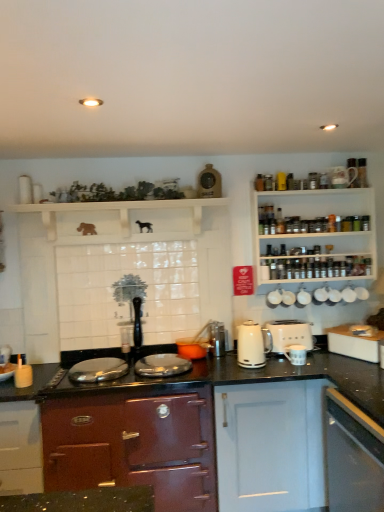
Question: From the image's perspective, is metallic silver kettle at center, the 2th appliance in the left-to-right sequence, over shiny burgundy cabinet at center, the 3th cabinetry from the right?

Choices:
 (A) yes
 (B) no

Answer: (A)

Question: Is metallic silver kettle at center, the second appliance from the bottom, thinner than shiny burgundy cabinet at center, the 3th cabinetry from the right?

Choices:
 (A) yes
 (B) no

Answer: (A)

Question: Would you say metallic silver kettle at center, the second appliance from the bottom, contains shiny burgundy cabinet at center, positioned as the first cabinetry in left-to-right order?

Choices:
 (A) no
 (B) yes

Answer: (A)

Question: Considering the relative sizes of metallic silver kettle at center, the second appliance from the bottom, and shiny burgundy cabinet at center, the 3th cabinetry from the right, in the image provided, is metallic silver kettle at center, the second appliance from the bottom, wider than shiny burgundy cabinet at center, the 3th cabinetry from the right,?

Choices:
 (A) yes
 (B) no

Answer: (B)

Question: Could you tell me if metallic silver kettle at center, the second appliance from the bottom, is facing shiny burgundy cabinet at center, positioned as the first cabinetry in left-to-right order?

Choices:
 (A) yes
 (B) no

Answer: (B)

Question: Is metallic silver kettle at center, acting as the fourth appliance starting from the top, to the left of shiny burgundy cabinet at center, the 3th cabinetry from the right, from the viewer's perspective?

Choices:
 (A) no
 (B) yes

Answer: (A)

Question: Can you confirm if metallic silver kettle at center, which is the 4th appliance in right-to-left order, is positioned to the left of white wooden spice rack at upper right?

Choices:
 (A) no
 (B) yes

Answer: (B)

Question: From a real-world perspective, is metallic silver kettle at center, the 2th appliance in the left-to-right sequence, physically above white wooden spice rack at upper right?

Choices:
 (A) yes
 (B) no

Answer: (B)

Question: From a real-world perspective, does metallic silver kettle at center, which is the 4th appliance in right-to-left order, sit lower than white wooden spice rack at upper right?

Choices:
 (A) yes
 (B) no

Answer: (A)

Question: Does metallic silver kettle at center, acting as the fourth appliance starting from the top, turn towards white wooden spice rack at upper right?

Choices:
 (A) yes
 (B) no

Answer: (B)

Question: From the image's perspective, is metallic silver kettle at center, acting as the fourth appliance starting from the top, located beneath white wooden spice rack at upper right?

Choices:
 (A) no
 (B) yes

Answer: (B)

Question: Is metallic silver kettle at center, the second appliance from the bottom, looking in the opposite direction of white wooden spice rack at upper right?

Choices:
 (A) yes
 (B) no

Answer: (B)

Question: Can you confirm if white glossy cabinet at lower right, the third cabinetry in the left-to-right sequence, is wider than white glossy cup at upper right, the 3th appliance positioned from the bottom?

Choices:
 (A) yes
 (B) no

Answer: (A)